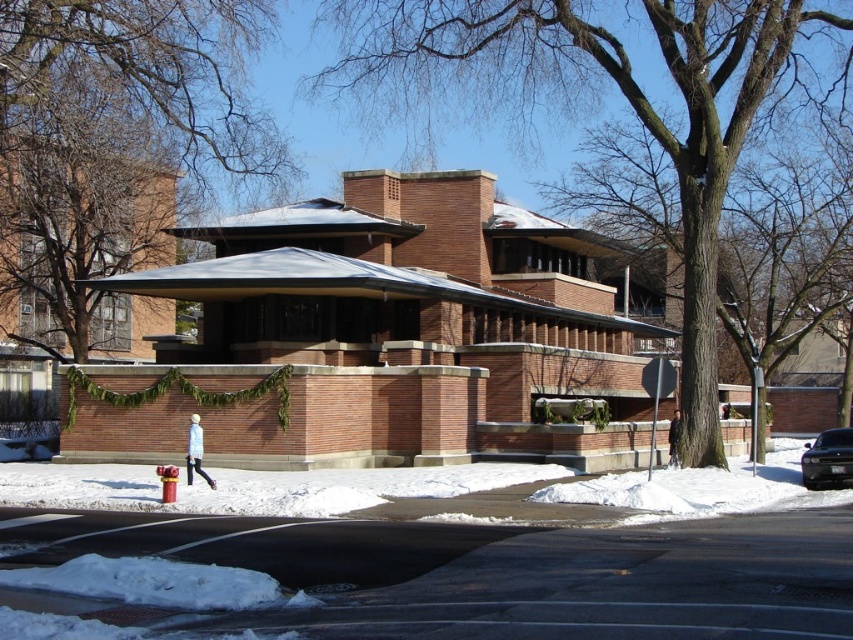
Looking at this image, you are a visitor at this architectural site and want to take a photo of the brown brick gazebo at center and the shiny black sedan at lower right. If you want to include both in the frame, which object should you position closer to the camera to ensure both fit horizontally?

The brown brick gazebo at center is wider than the shiny black sedan at lower right. To include both in the frame, position the brown brick gazebo at center closer to the camera since its greater width requires more space in the photo.

You are standing in a park and see the brown brick gazebo at center. If you want to take a photo of it from a distance of exactly 24 meters, should you move closer or farther away?

The current distance between you and the brown brick gazebo at center is 23.55 meters. To achieve a distance of 24 meters, you should move slightly farther away from the gazebo.

You are a visitor at this architectural site and want to take a photo of the brown brick gazebo at center without any vehicles in the frame. Given the position of the shiny black sedan at lower right, is it possible to do so from your current viewpoint?

The shiny black sedan at lower right is behind the brown brick gazebo at center, so taking a photo from your current viewpoint would have the gazebo in front, blocking the sedan. Therefore, it is possible to take a photo of the brown brick gazebo at center without the shiny black sedan at lower right in the frame.